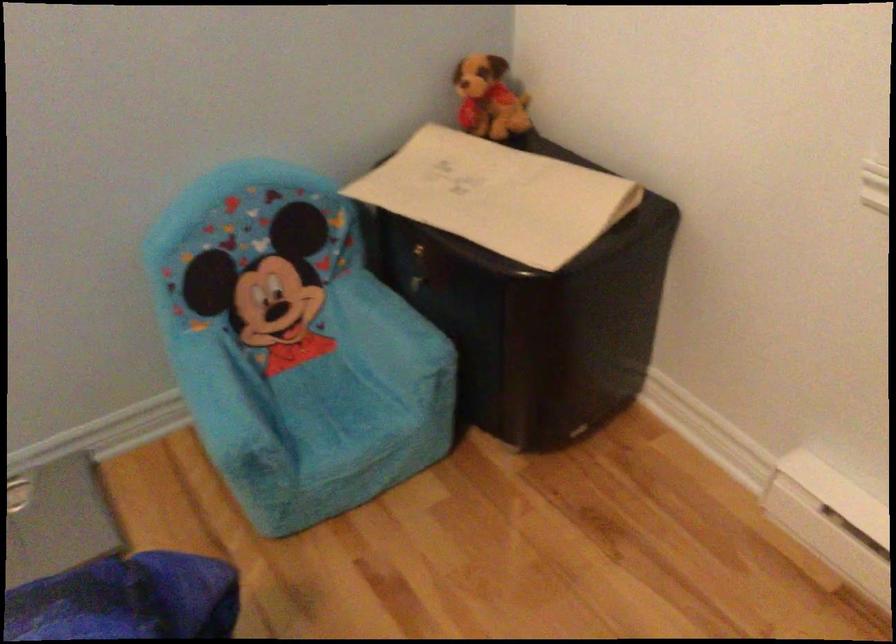
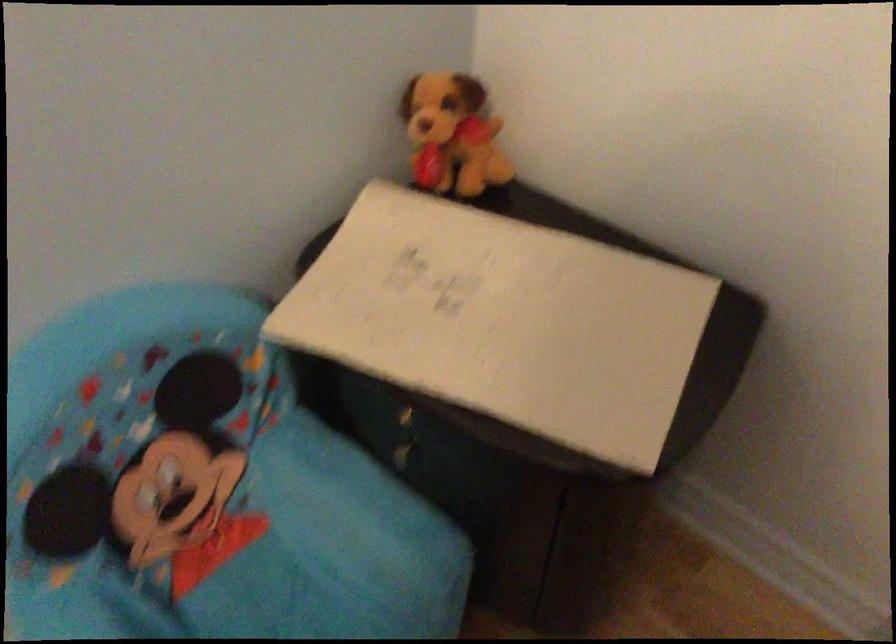
Find the pixel in the second image that matches the point at 484,88 in the first image.

(452, 134)